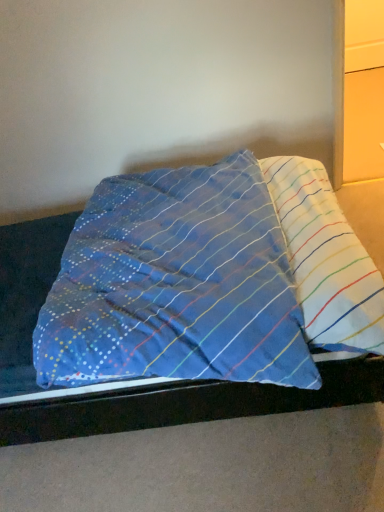
Describe the element at coordinates (191, 304) in the screenshot. The image size is (384, 512). I see `blue fabric pillow at center` at that location.

Measure the distance between point (179, 419) and camera.

Point (179, 419) and camera are 4.74 feet apart from each other.

Image resolution: width=384 pixels, height=512 pixels. What are the coordinates of `blue fabric pillow at center` in the screenshot? It's located at (191, 304).

Find the location of `blue fabric pillow at center`. blue fabric pillow at center is located at coordinates (191, 304).